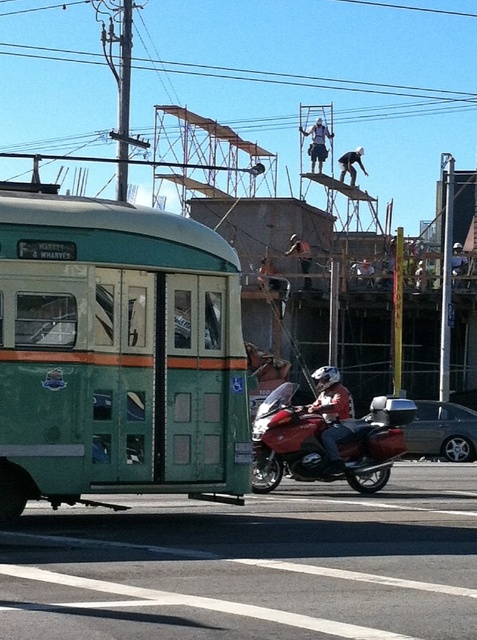
Question: Which point appears farthest from the camera in this image?

Choices:
 (A) (476, 451)
 (B) (300, 125)
 (C) (284, 252)
 (D) (361, 273)

Answer: (B)

Question: Among these points, which one is nearest to the camera?

Choices:
 (A) (346, 150)
 (B) (303, 253)
 (C) (437, 432)
 (D) (321, 406)

Answer: (D)

Question: Does red leather jacket at center appear on the left side of metallic helmet at center?

Choices:
 (A) no
 (B) yes

Answer: (B)

Question: Does white helmeted person at upper center have a larger size compared to metallic helmet at center?

Choices:
 (A) yes
 (B) no

Answer: (A)

Question: Estimate the real-world distances between objects in this image. Which object is closer to the shiny silver sedan at center?

Choices:
 (A) metallic helmet at center
 (B) glossy red motorcycle at center
 (C) red leather jacket at center

Answer: (B)

Question: Can you confirm if red leather jacket at center is wider than light blue fabric at center?

Choices:
 (A) no
 (B) yes

Answer: (A)